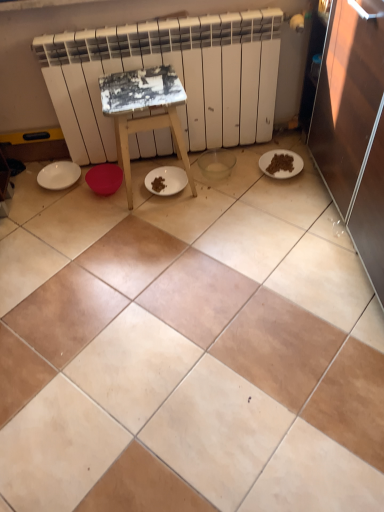
Where is `vacant area on top of white matte plate at left, which is counted as the 1th paper plate, starting from the left (from a real-world perspective)`? vacant area on top of white matte plate at left, which is counted as the 1th paper plate, starting from the left (from a real-world perspective) is located at coordinates (59, 174).